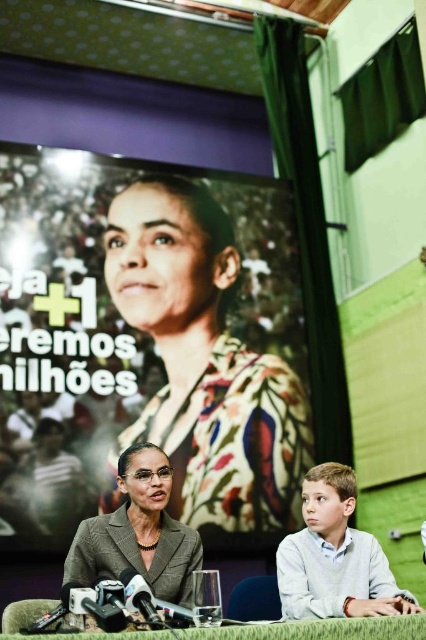
In the scene shown: You are a photographer adjusting the focus of your camera. You need to focus on both the point at point [140,292] and point [290,625]. Which point should you focus on first to ensure both are in focus?

You should focus on point [140,292] first because it is closer to the camera than point [290,625]. This ensures that both points will be in focus when adjusting the focus depth.